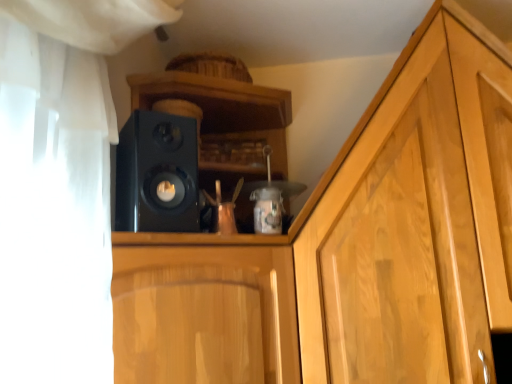
Question: Does point (116, 210) appear closer or farther from the camera than point (214, 352)?

Choices:
 (A) farther
 (B) closer

Answer: (A)

Question: From the image's perspective, relative to glossy wood cabinet at center, is black matte speaker at center above or below?

Choices:
 (A) above
 (B) below

Answer: (A)

Question: From a real-world perspective, relative to glossy wood cabinet at center, is black matte speaker at center vertically above or below?

Choices:
 (A) below
 (B) above

Answer: (B)

Question: Do you think glossy wood cabinet at center is within black matte speaker at center, or outside of it?

Choices:
 (A) outside
 (B) inside

Answer: (A)

Question: Considering their positions, is glossy wood cabinet at center located in front of or behind black matte speaker at center?

Choices:
 (A) front
 (B) behind

Answer: (A)

Question: In the image, is glossy wood cabinet at center on the left side or the right side of black matte speaker at center?

Choices:
 (A) left
 (B) right

Answer: (B)

Question: In terms of size, does glossy wood cabinet at center appear bigger or smaller than black matte speaker at center?

Choices:
 (A) small
 (B) big

Answer: (B)